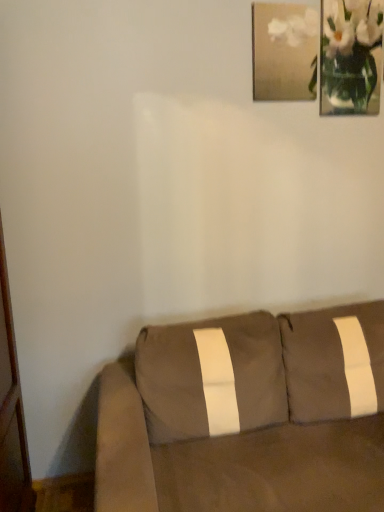
Describe the element at coordinates (247, 415) in the screenshot. I see `suede brown couch at lower right` at that location.

Measure the distance between point (x=98, y=495) and camera.

The depth of point (x=98, y=495) is 1.17 meters.

Image resolution: width=384 pixels, height=512 pixels. I want to click on matte gold picture frame at upper right, so click(x=284, y=52).

Is suede brown couch at lower right positioned far away from white glass vase at upper right?

Yes.

From the image's perspective, is suede brown couch at lower right on white glass vase at upper right?

No, from the image's perspective, suede brown couch at lower right is not over white glass vase at upper right.

Considering the relative sizes of suede brown couch at lower right and white glass vase at upper right in the image provided, is suede brown couch at lower right bigger than white glass vase at upper right?

Yes, suede brown couch at lower right is bigger than white glass vase at upper right.

Which is more to the left, suede brown couch at lower right or white glass vase at upper right?

From the viewer's perspective, suede brown couch at lower right appears more on the left side.

From the image's perspective, between matte gold picture frame at upper right and suede brown couch at lower right, who is located below?

suede brown couch at lower right is shown below in the image.

From a real-world perspective, who is located higher, matte gold picture frame at upper right or suede brown couch at lower right?

In real-world perspective, matte gold picture frame at upper right is above.

Can you see matte gold picture frame at upper right touching suede brown couch at lower right?

No, matte gold picture frame at upper right is not touching suede brown couch at lower right.

Measure the distance between matte gold picture frame at upper right and suede brown couch at lower right.

A distance of 4.16 feet exists between matte gold picture frame at upper right and suede brown couch at lower right.

Can you confirm if suede brown couch at lower right is positioned to the right of matte gold picture frame at upper right?

No.

Looking at the image, does suede brown couch at lower right seem bigger or smaller compared to matte gold picture frame at upper right?

Clearly, suede brown couch at lower right is larger in size than matte gold picture frame at upper right.

From the image's perspective, is suede brown couch at lower right above or below matte gold picture frame at upper right?

Clearly, from the image's perspective, suede brown couch at lower right is below matte gold picture frame at upper right.

Does suede brown couch at lower right turn towards matte gold picture frame at upper right?

No, suede brown couch at lower right does not turn towards matte gold picture frame at upper right.

Which object is closer to the camera, matte gold picture frame at upper right or white glass vase at upper right?

matte gold picture frame at upper right.

Between matte gold picture frame at upper right and white glass vase at upper right, which one has more height?

With more height is white glass vase at upper right.

Are matte gold picture frame at upper right and white glass vase at upper right beside each other?

matte gold picture frame at upper right is not next to white glass vase at upper right, and they're not touching.

Which of these two, matte gold picture frame at upper right or white glass vase at upper right, is thinner?

white glass vase at upper right is thinner.

Is matte gold picture frame at upper right at the back of white glass vase at upper right?

white glass vase at upper right does not have its back to matte gold picture frame at upper right.

The width and height of the screenshot is (384, 512). Identify the location of picture frame that appears on the left of white glass vase at upper right. (284, 52).

Which object is further away from the camera taking this photo, white glass vase at upper right or matte gold picture frame at upper right?

white glass vase at upper right is further away from the camera.

Between point (376, 92) and point (314, 52), which one is positioned behind?

Positioned behind is point (376, 92).

Considering the sizes of objects white glass vase at upper right and suede brown couch at lower right in the image provided, who is bigger, white glass vase at upper right or suede brown couch at lower right?

suede brown couch at lower right.

In the scene shown: Considering the positions of objects white glass vase at upper right and suede brown couch at lower right in the image provided, who is behind, white glass vase at upper right or suede brown couch at lower right?

white glass vase at upper right is behind.

What are the coordinates of `floral arrangement behind the suede brown couch at lower right` in the screenshot? It's located at (350, 56).

Consider the image. Can you confirm if white glass vase at upper right is thinner than suede brown couch at lower right?

Yes, white glass vase at upper right is thinner than suede brown couch at lower right.

Identify the location of studio couch in front of the white glass vase at upper right. This screenshot has width=384, height=512. (247, 415).

Find the location of `studio couch below the matte gold picture frame at upper right (from the image's perspective)`. studio couch below the matte gold picture frame at upper right (from the image's perspective) is located at coordinates (247, 415).

From the image, which object appears to be nearer to suede brown couch at lower right, white glass vase at upper right or matte gold picture frame at upper right?

The object closer to suede brown couch at lower right is matte gold picture frame at upper right.

From the image, which object appears to be nearer to matte gold picture frame at upper right, white glass vase at upper right or suede brown couch at lower right?

white glass vase at upper right lies closer to matte gold picture frame at upper right than the other object.

Looking at the image, which one is located closer to suede brown couch at lower right, matte gold picture frame at upper right or white glass vase at upper right?

The object closer to suede brown couch at lower right is matte gold picture frame at upper right.

Consider the image. Based on their spatial positions, is suede brown couch at lower right or matte gold picture frame at upper right further from white glass vase at upper right?

suede brown couch at lower right.

Looking at the image, which one is located closer to white glass vase at upper right, matte gold picture frame at upper right or suede brown couch at lower right?

matte gold picture frame at upper right is closer to white glass vase at upper right.

Considering their positions, is suede brown couch at lower right positioned closer to matte gold picture frame at upper right than white glass vase at upper right?

white glass vase at upper right is positioned closer to the anchor matte gold picture frame at upper right.

Find the location of a particular element. picture frame between white glass vase at upper right and suede brown couch at lower right in the up-down direction is located at coordinates (284, 52).